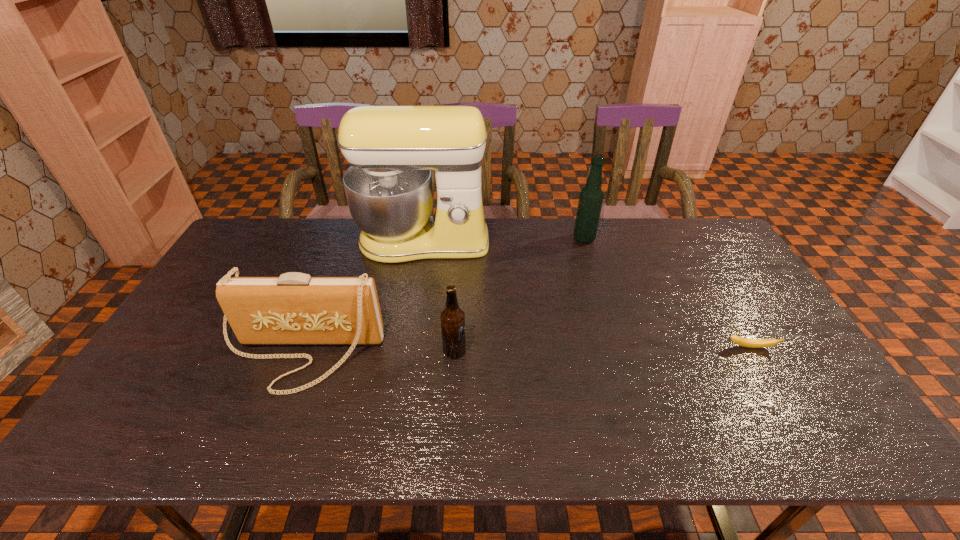
This screenshot has height=540, width=960. Find the location of `the tallest object`. the tallest object is located at coordinates (391, 149).

Where is `the second tallest object`? The height and width of the screenshot is (540, 960). the second tallest object is located at coordinates (591, 197).

Locate an element on the screen. alcohol is located at coordinates (591, 197).

This screenshot has width=960, height=540. In order to click on handbag in this screenshot , I will do `click(295, 308)`.

Locate an element on the screen. beer bottle is located at coordinates (452, 317).

Where is `the rightmost object`? This screenshot has height=540, width=960. the rightmost object is located at coordinates (745, 342).

Identify the location of banana. The width and height of the screenshot is (960, 540). (745, 342).

In order to click on vacant region located 0.260m on the side of the tallest object with the control knob in this screenshot , I will do `click(410, 325)`.

Find the location of `vacant point located 0.400m on the front of the alcohol`. vacant point located 0.400m on the front of the alcohol is located at coordinates (612, 332).

Where is `free space located on the decorative side of the handbag`? The width and height of the screenshot is (960, 540). free space located on the decorative side of the handbag is located at coordinates (271, 430).